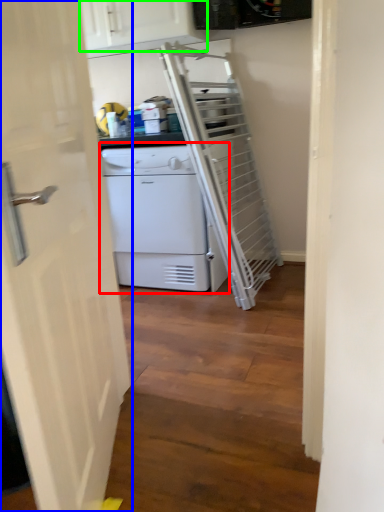
Question: Which object is positioned farthest from home appliance (highlighted by a red box)? Select from door (highlighted by a blue box) and cabinetry (highlighted by a green box).

Choices:
 (A) door
 (B) cabinetry

Answer: (A)